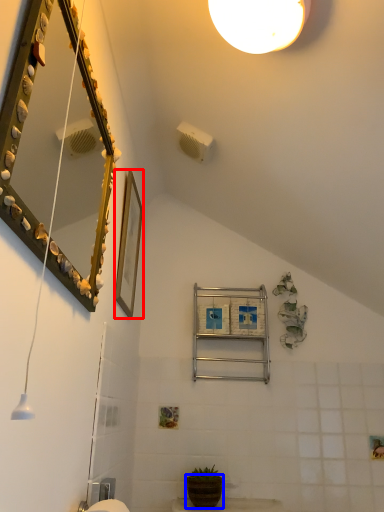
Question: Which of the following is the closest to the observer, picture frame (highlighted by a red box) or flowerpot (highlighted by a blue box)?

Choices:
 (A) picture frame
 (B) flowerpot

Answer: (A)